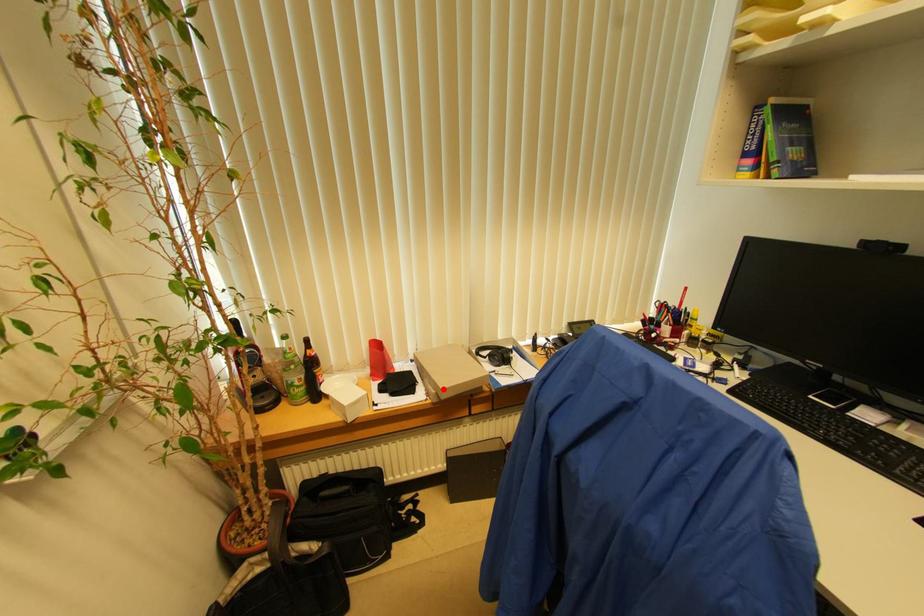
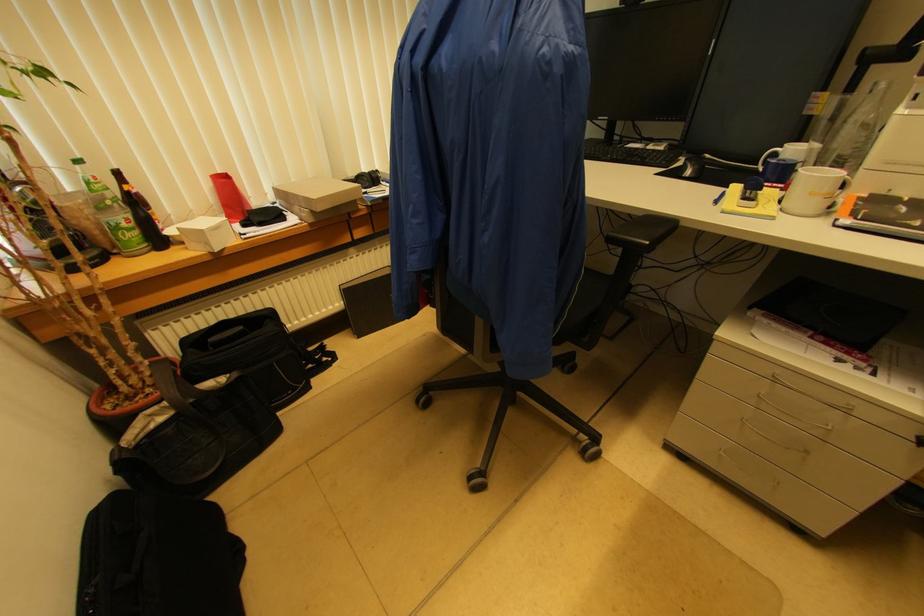
In the second image, find the point that corresponds to the highlighted location in the first image.

(315, 200)